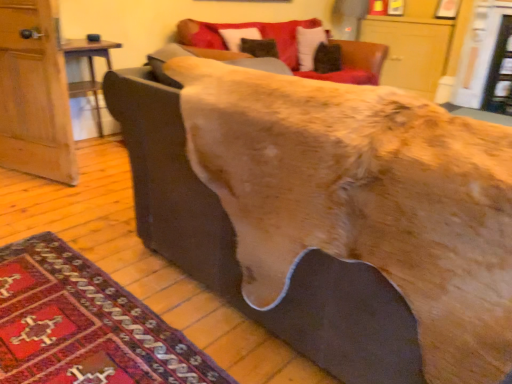
Describe the element at coordinates (234, 243) in the screenshot. Image resolution: width=512 pixels, height=384 pixels. I see `brown leather couch at center` at that location.

Locate an element on the screen. Image resolution: width=512 pixels, height=384 pixels. carpeted rug at lower left is located at coordinates (85, 325).

In the scene shown: Is brown leather couch at center completely or partially outside of velvet-like brown pillow at upper center?

Absolutely, brown leather couch at center is external to velvet-like brown pillow at upper center.

Between brown leather couch at center and velvet-like brown pillow at upper center, which one has larger size?

With larger size is brown leather couch at center.

Is point (373, 297) positioned after point (298, 47)?

No, (373, 297) is in front of (298, 47).

From a real-world perspective, is brown leather couch at center positioned above or below velvet-like brown pillow at upper center?

Clearly, from a real-world perspective, brown leather couch at center is below velvet-like brown pillow at upper center.

Consider the image. What's the angular difference between wooden table at left and velvet-like brown pillow at upper center's facing directions?

0.626 degrees.

Is wooden table at left touching velvet-like brown pillow at upper center?

No.

What are the coordinates of `table in front of the velvet-like brown pillow at upper center` in the screenshot? It's located at (89, 69).

From the picture: In the image, is wooden table at left positioned in front of or behind velvet-like brown pillow at upper center?

Clearly, wooden table at left is in front of velvet-like brown pillow at upper center.

From a real-world perspective, does wooden table at left sit lower than brown leather couch at center?

Yes, from a real-world perspective, wooden table at left is below brown leather couch at center.

From their relative heights in the image, would you say wooden table at left is taller or shorter than brown leather couch at center?

wooden table at left is shorter than brown leather couch at center.

From the image's perspective, is wooden table at left located above or below brown leather couch at center?

From the image's perspective, wooden table at left appears above brown leather couch at center.

Between wooden table at left and brown leather couch at center, which one appears on the left side from the viewer's perspective?

From the viewer's perspective, wooden table at left appears more on the left side.

From a real-world perspective, is carpeted rug at lower left on brown leather couch at center?

Actually, carpeted rug at lower left is physically below brown leather couch at center in the real world.

Choose the correct answer: Is carpeted rug at lower left inside brown leather couch at center or outside it?

carpeted rug at lower left is outside brown leather couch at center.

Is carpeted rug at lower left positioned behind brown leather couch at center?

Yes, carpeted rug at lower left is behind brown leather couch at center.

Is carpeted rug at lower left to the left or to the right of brown leather couch at center in the image?

carpeted rug at lower left is to the left of brown leather couch at center.

Between velvet-like brown pillow at upper center and wooden table at left, which one is positioned in front?

wooden table at left.

You are a GUI agent. You are given a task and a screenshot of the screen. Output one action in this format:
    pyautogui.click(x=<x>, y=<y>)
    Task: Click on the pillow to the right of wooden table at left
    The width and height of the screenshot is (512, 384).
    Given the screenshot: What is the action you would take?
    pyautogui.click(x=309, y=45)

Considering the relative positions of carpeted rug at lower left and wooden table at left in the image provided, is carpeted rug at lower left behind wooden table at left?

No, it is in front of wooden table at left.

Would you say carpeted rug at lower left is a long distance from wooden table at left?

Yes, carpeted rug at lower left and wooden table at left are quite far apart.

From the image's perspective, which one is positioned higher, carpeted rug at lower left or wooden table at left?

wooden table at left appears higher in the image.

In terms of width, does carpeted rug at lower left look wider or thinner when compared to wooden table at left?

In the image, carpeted rug at lower left appears to be wider than wooden table at left.

Would you say velvet-like brown pillow at upper center contains carpeted rug at lower left?

No.

Can you confirm if velvet-like brown pillow at upper center is smaller than carpeted rug at lower left?

No.

From a real-world perspective, which object rests below the other?

In real-world perspective, carpeted rug at lower left is lower.

Find the location of a particular element. furniture located on the left of velvet-like brown pillow at upper center is located at coordinates (234, 243).

Image resolution: width=512 pixels, height=384 pixels. I want to click on pillow on the right side of wooden table at left, so click(309, 45).

Based on their spatial positions, is carpeted rug at lower left or wooden table at left further from brown leather couch at center?

wooden table at left.

From the image, which object appears to be farther from velvet-like brown pillow at upper center, carpeted rug at lower left or brown leather couch at center?

Among the two, carpeted rug at lower left is located further to velvet-like brown pillow at upper center.

Considering their positions, is wooden table at left positioned closer to brown leather couch at center than carpeted rug at lower left?

Based on the image, carpeted rug at lower left appears to be nearer to brown leather couch at center.

Based on their spatial positions, is wooden table at left or brown leather couch at center closer to velvet-like brown pillow at upper center?

wooden table at left is closer to velvet-like brown pillow at upper center.

Based on their spatial positions, is wooden table at left or velvet-like brown pillow at upper center closer to carpeted rug at lower left?

wooden table at left is closer to carpeted rug at lower left.

Considering their positions, is brown leather couch at center positioned closer to carpeted rug at lower left than wooden table at left?

Based on the image, brown leather couch at center appears to be nearer to carpeted rug at lower left.

Which object lies further to the anchor point wooden table at left, brown leather couch at center or carpeted rug at lower left?

Based on the image, carpeted rug at lower left appears to be further to wooden table at left.

From the picture: Estimate the real-world distances between objects in this image. Which object is closer to carpeted rug at lower left, brown leather couch at center or velvet-like brown pillow at upper center?

Based on the image, brown leather couch at center appears to be nearer to carpeted rug at lower left.

Image resolution: width=512 pixels, height=384 pixels. I want to click on table between brown leather couch at center and velvet-like brown pillow at upper center from front to back, so click(89, 69).

Identify the location of mat located between brown leather couch at center and wooden table at left in the depth direction. (85, 325).

Where is `mat located between brown leather couch at center and velvet-like brown pillow at upper center in the depth direction`? Image resolution: width=512 pixels, height=384 pixels. mat located between brown leather couch at center and velvet-like brown pillow at upper center in the depth direction is located at coordinates (85, 325).

This screenshot has height=384, width=512. In order to click on table positioned between carpeted rug at lower left and velvet-like brown pillow at upper center from near to far in this screenshot , I will do `click(89, 69)`.